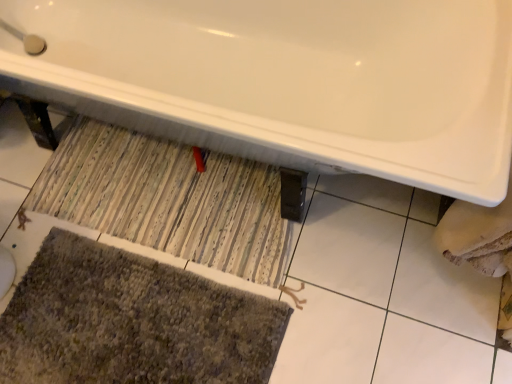
The height and width of the screenshot is (384, 512). Find the location of `vacant area that lies in front of striped fabric doormat at center`. vacant area that lies in front of striped fabric doormat at center is located at coordinates (176, 319).